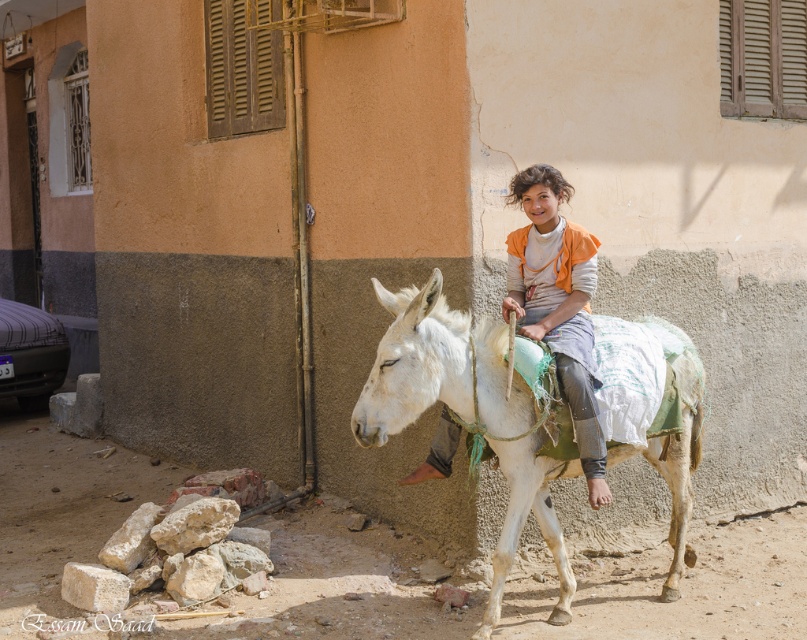
Question: Among these objects, which one is nearest to the camera?

Choices:
 (A) white matte mule at center
 (B) metallic car at left
 (C) orange fabric shirt at center

Answer: (A)

Question: Which point is farther to the camera?

Choices:
 (A) (23, 397)
 (B) (688, 448)

Answer: (A)

Question: Does orange fabric shirt at center have a lesser width compared to metallic car at left?

Choices:
 (A) no
 (B) yes

Answer: (B)

Question: Is the position of white matte mule at center more distant than that of orange fabric shirt at center?

Choices:
 (A) yes
 (B) no

Answer: (B)

Question: Which of the following is the closest to the observer?

Choices:
 (A) (437, 451)
 (B) (442, 348)

Answer: (B)

Question: Observing the image, what is the correct spatial positioning of white matte mule at center in reference to metallic car at left?

Choices:
 (A) below
 (B) above

Answer: (A)